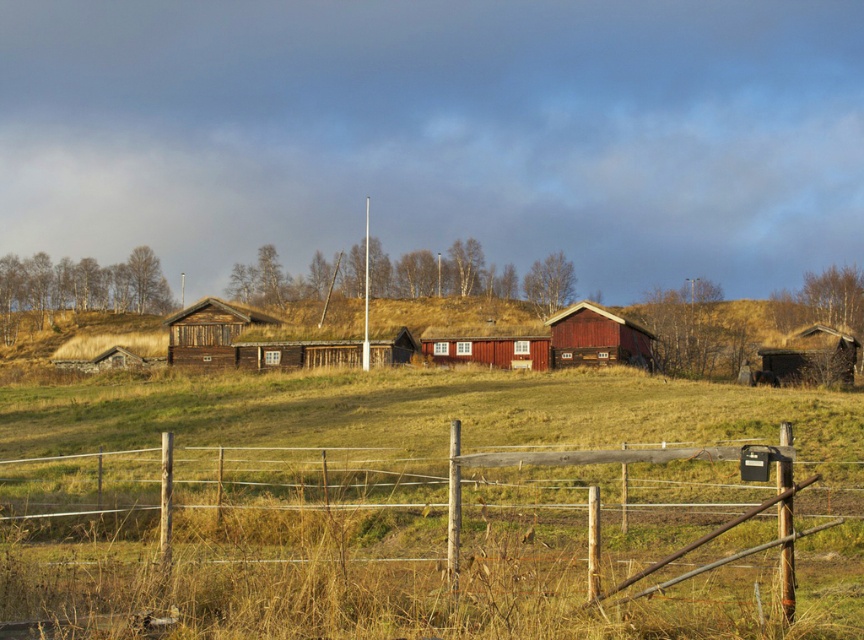
You are standing at the entrance of the rural landscape and see the wooden gate at lower center and the matte wooden hut at center. Which object is positioned to the left when facing towards the scene?

The wooden gate at lower center is to the left of the matte wooden hut at center, so the wooden gate at lower center is positioned to the left when facing towards the scene.

You are standing at the entrance of the wooden gate at lower center. Looking towards the red building with white windows, which direction should you walk to reach it?

The red building with white windows is located to the north of the wooden gate at lower center, so you should walk north to reach it.